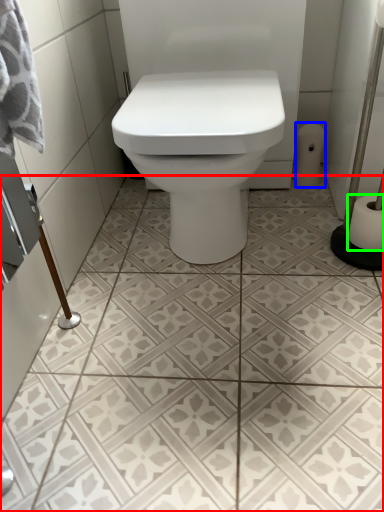
Question: Considering the real-world distances, which object is farthest from ceramic tile (highlighted by a red box)? toilet paper (highlighted by a blue box) or toilet paper (highlighted by a green box)?

Choices:
 (A) toilet paper
 (B) toilet paper

Answer: (A)